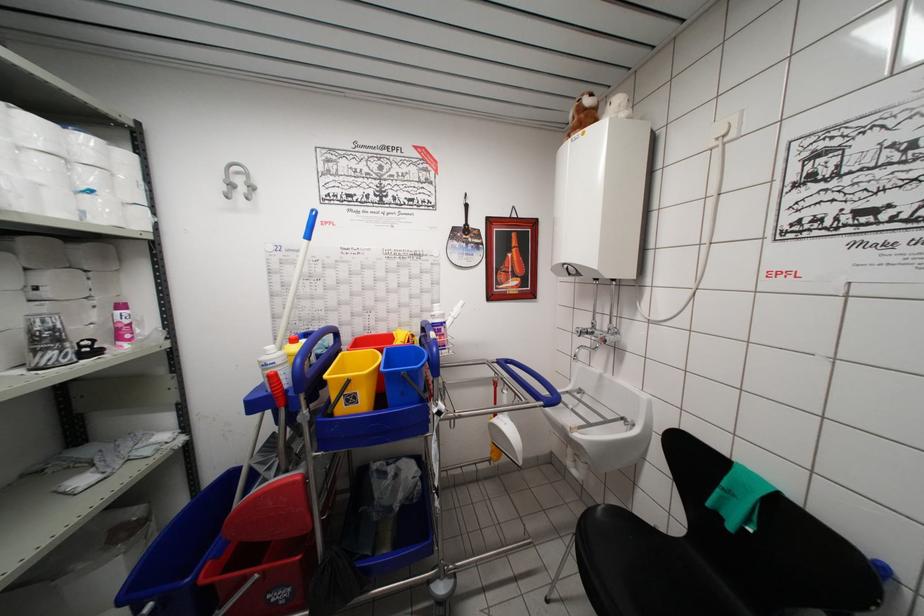
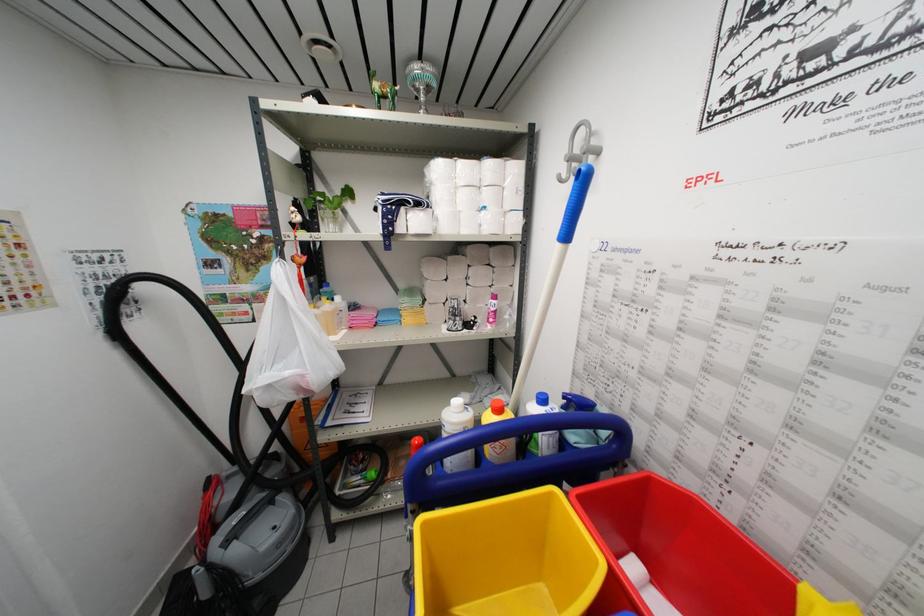
In the second image, find the point that corresponds to point 137,456 in the first image.

(490, 402)